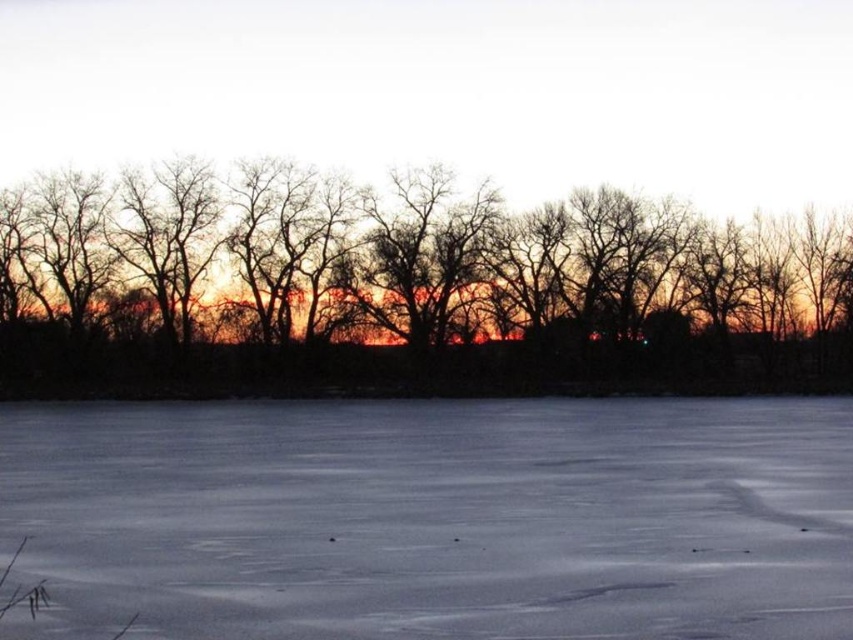
Question: Is white smooth snow at center wider than black matte trees at center?

Choices:
 (A) yes
 (B) no

Answer: (B)

Question: Among these points, which one is farthest from the camera?

Choices:
 (A) (831, 216)
 (B) (395, 586)

Answer: (A)

Question: Can you confirm if white smooth snow at center is positioned above black matte trees at center?

Choices:
 (A) no
 (B) yes

Answer: (A)

Question: Does white smooth snow at center lie behind black matte trees at center?

Choices:
 (A) yes
 (B) no

Answer: (B)